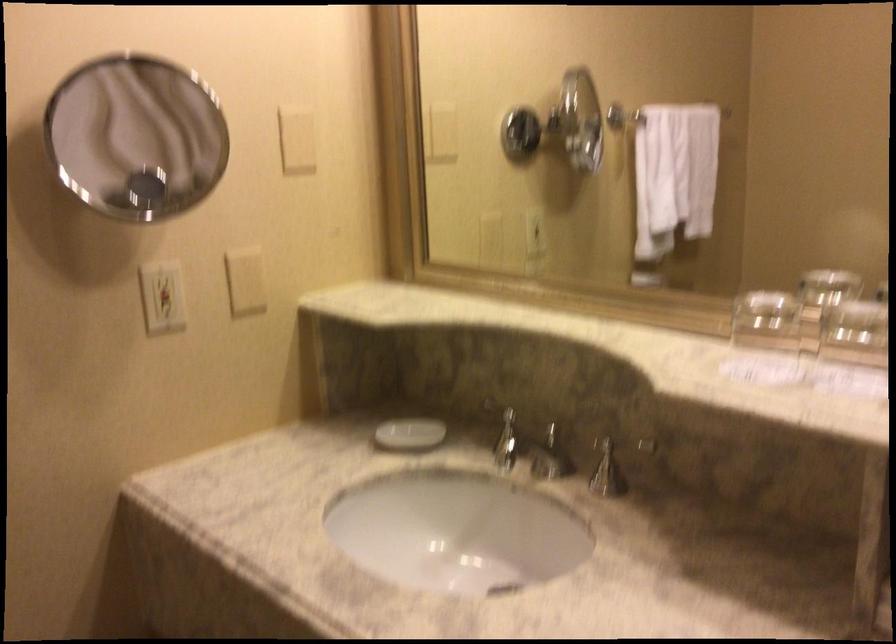
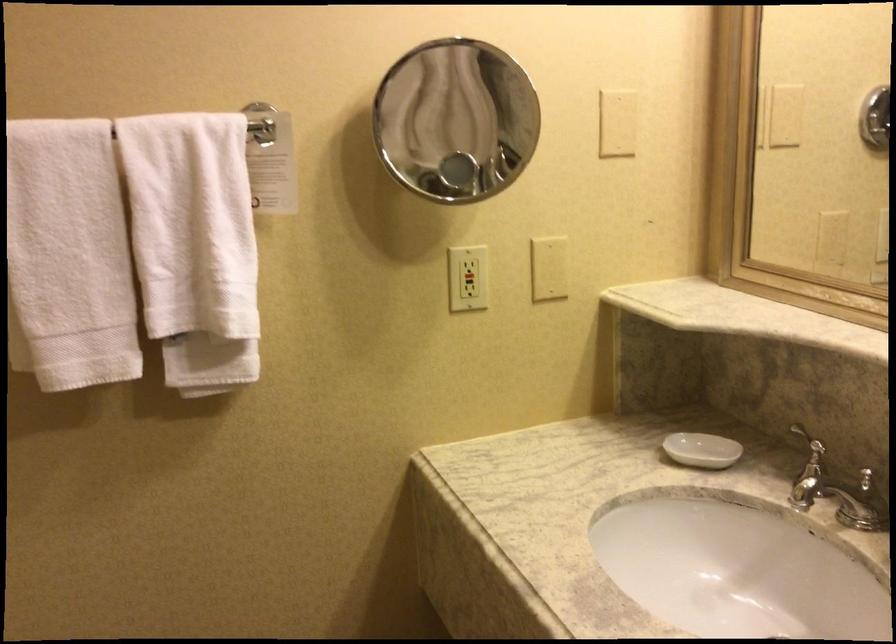
Find the pixel in the second image that matches pixel 410 435 in the first image.

(702, 450)